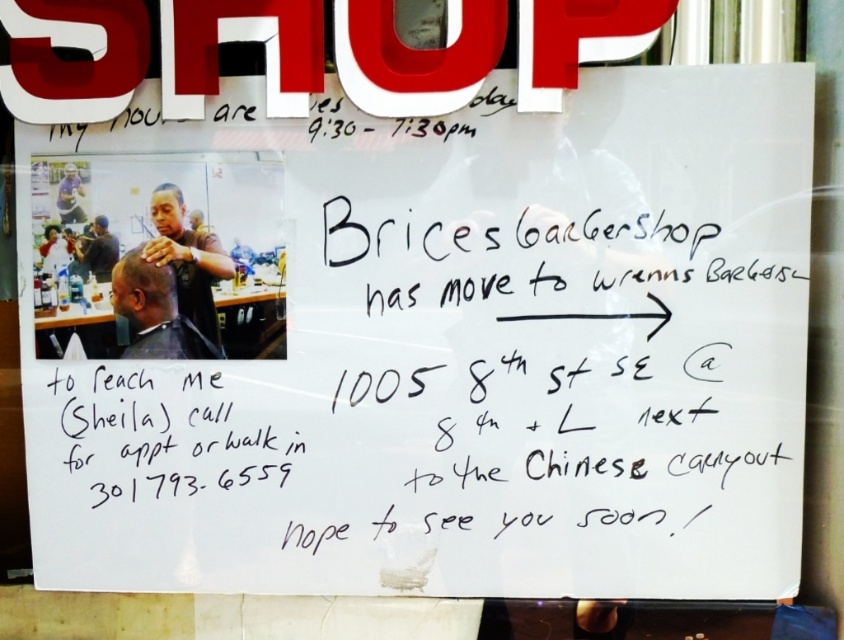
Does dark brown hair at upper left appear on the right side of matte black hair at upper left?

Correct, you'll find dark brown hair at upper left to the right of matte black hair at upper left.

Does dark brown hair at upper left lie in front of matte black hair at upper left?

No, it is behind matte black hair at upper left.

Is point (139, 304) positioned behind point (111, 269)?

Yes, point (139, 304) is behind point (111, 269).

Locate an element on the screen. dark brown hair at upper left is located at coordinates (155, 310).

Is point (198, 250) more distant than point (155, 296)?

No, it is in front of (155, 296).

Does matte black barber at upper left have a lesser height compared to dark brown hair at center?

No, matte black barber at upper left is not shorter than dark brown hair at center.

Is point (203, 304) positioned after point (143, 273)?

Yes, point (203, 304) is farther from viewer.

This screenshot has width=844, height=640. Find the location of `matte black barber at upper left`. matte black barber at upper left is located at coordinates (187, 259).

Does matte black barber chair at upper left appear on the left side of dark brown hair at upper left?

In fact, matte black barber chair at upper left is to the right of dark brown hair at upper left.

The height and width of the screenshot is (640, 844). Find the location of `matte black barber chair at upper left`. matte black barber chair at upper left is located at coordinates (160, 248).